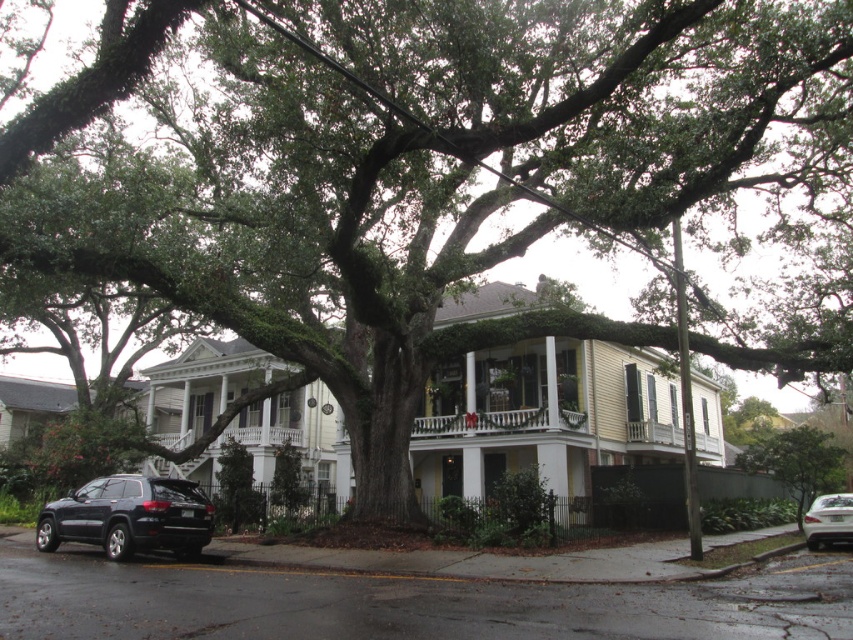
Who is lower down, white painted wood porch at center or silver metallic sedan at lower right?

silver metallic sedan at lower right is below.

Which is behind, point (541, 413) or point (822, 516)?

Point (541, 413)

Locate an element on the screen. white painted wood porch at center is located at coordinates (498, 420).

Does black matte suv at lower left have a lesser height compared to white painted wood porch at center?

Yes.

Is black matte suv at lower left thinner than white painted wood porch at center?

Yes, black matte suv at lower left is thinner than white painted wood porch at center.

The width and height of the screenshot is (853, 640). Identify the location of black matte suv at lower left. (129, 516).

From the picture: Between green leafy tree at center and silver metallic sedan at lower right, which one has less height?

With less height is silver metallic sedan at lower right.

Between green leafy tree at center and silver metallic sedan at lower right, which one appears on the left side from the viewer's perspective?

silver metallic sedan at lower right is more to the left.

Identify the location of green leafy tree at center. (796, 461).